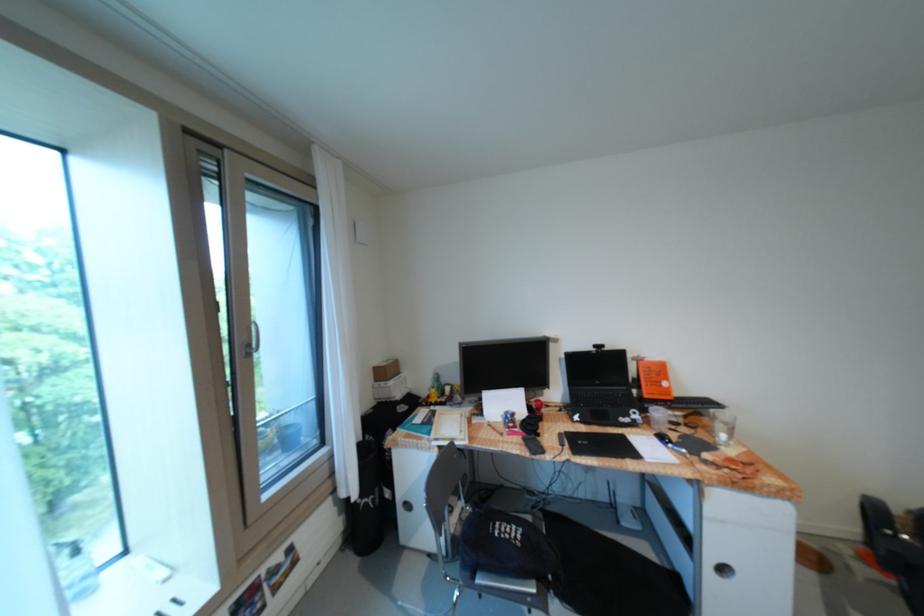
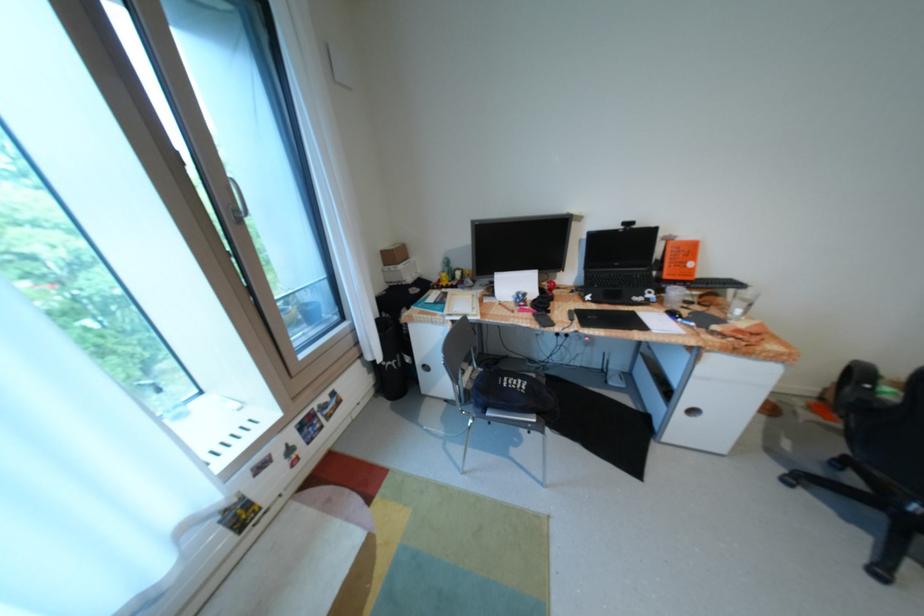
Locate, in the second image, the point that corresponds to (387,384) in the first image.

(397, 268)